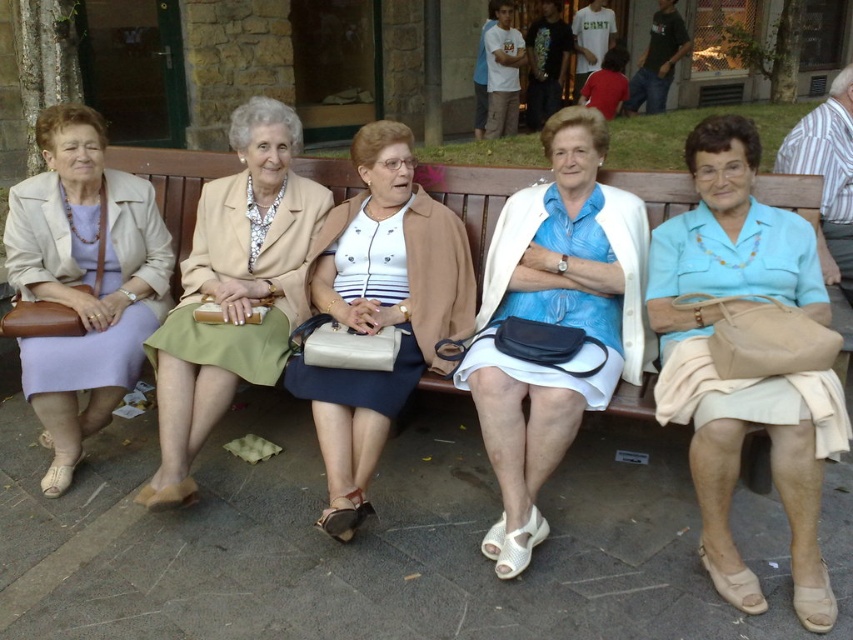
Can you confirm if light blue fabric blouse at center is thinner than white matte skirt at center?

Indeed, light blue fabric blouse at center has a lesser width compared to white matte skirt at center.

Based on the photo, is light blue fabric blouse at center to the right of white matte skirt at center from the viewer's perspective?

Yes, light blue fabric blouse at center is to the right of white matte skirt at center.

Is point (764, 419) farther from viewer compared to point (374, 284)?

No, it is in front of (374, 284).

Identify the location of light blue fabric blouse at center. This screenshot has height=640, width=853. (743, 378).

Is light blue fabric dress at center above white matte skirt at center?

Incorrect, light blue fabric dress at center is not positioned above white matte skirt at center.

Between point (630, 314) and point (337, 276), which one is positioned behind?

The point (337, 276) is behind.

Does point (494, 349) come behind point (386, 145)?

No.

This screenshot has width=853, height=640. Identify the location of light blue fabric dress at center. (555, 321).

Does point (735, 129) lie in front of point (447, 179)?

Yes, it is in front of point (447, 179).

Who is lower down, light blue fabric blouse at center or brown wooden bench at center?

light blue fabric blouse at center is lower down.

Where is `light blue fabric blouse at center`? The image size is (853, 640). light blue fabric blouse at center is located at coordinates (743, 378).

Where is `light blue fabric blouse at center`? light blue fabric blouse at center is located at coordinates (743, 378).